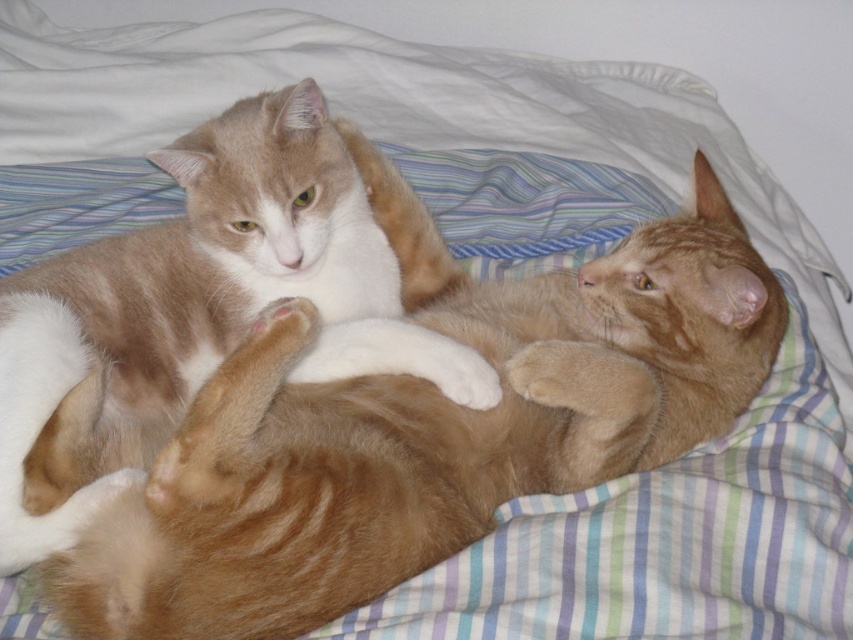
You are taking a photo of the two cats on the bed. You want to focus on the point that is closer to the camera. Which point should you choose between point (614, 340) and point (129, 294)?

You should choose point (614, 340) because it is closer to the camera than point (129, 294).

You are a photographer trying to capture both cats in the image. Since you want to ensure the orange fur cat at upper left and the orange tabby cat at center are both visible, which cat should you focus on first to make sure the depth of field captures both?

The orange fur cat at upper left is positioned under orange tabby cat at center, so focusing on the orange tabby cat at center first will ensure both are in focus as the orange fur cat at upper left is closer to the camera.

You are a photographer wanting to capture the orange fur cat at upper left in the center of your photo. Given the current position of the cat at point (424, 428), would you need to move the camera to the left or right to center the cat?

The orange fur cat at upper left is located at point (424, 428). To center the cat in the photo, you would need to move the camera to the right since the cat is positioned on the upper left side of the image.